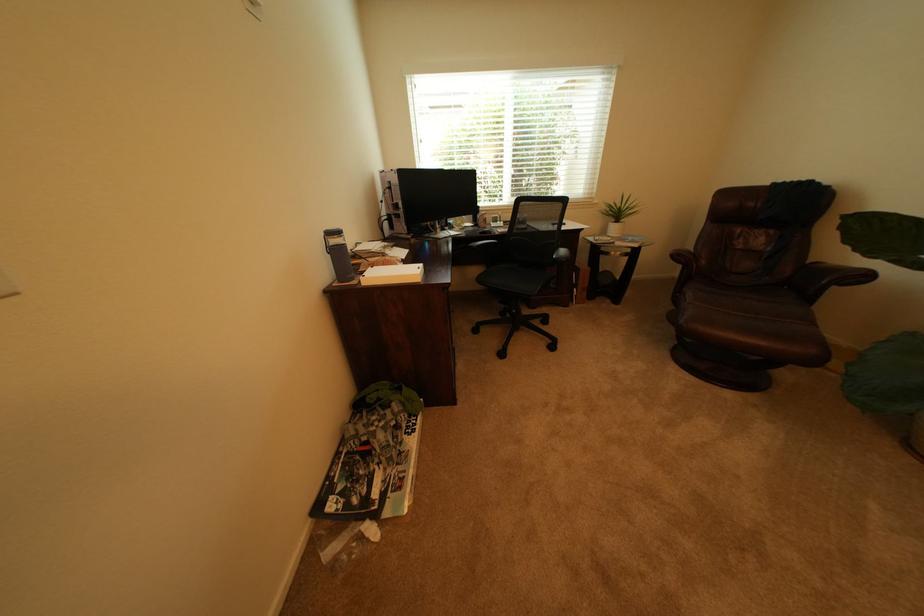
The image size is (924, 616). What are the coordinates of `grey water bottle` in the screenshot? It's located at (338, 254).